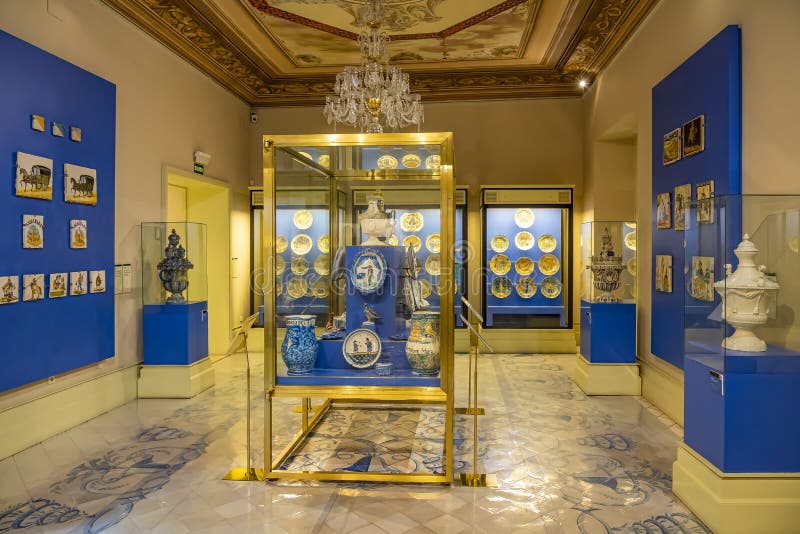
Identify the location of glass. Image resolution: width=800 pixels, height=534 pixels. (188, 240), (592, 240), (752, 231), (300, 219), (509, 221), (450, 225), (282, 227).